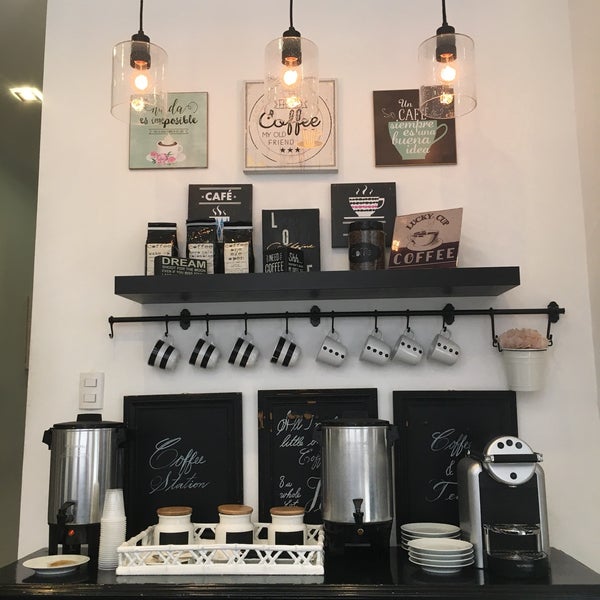
Where is `stacks of white ceramic plates`? stacks of white ceramic plates is located at coordinates (446, 552), (435, 535).